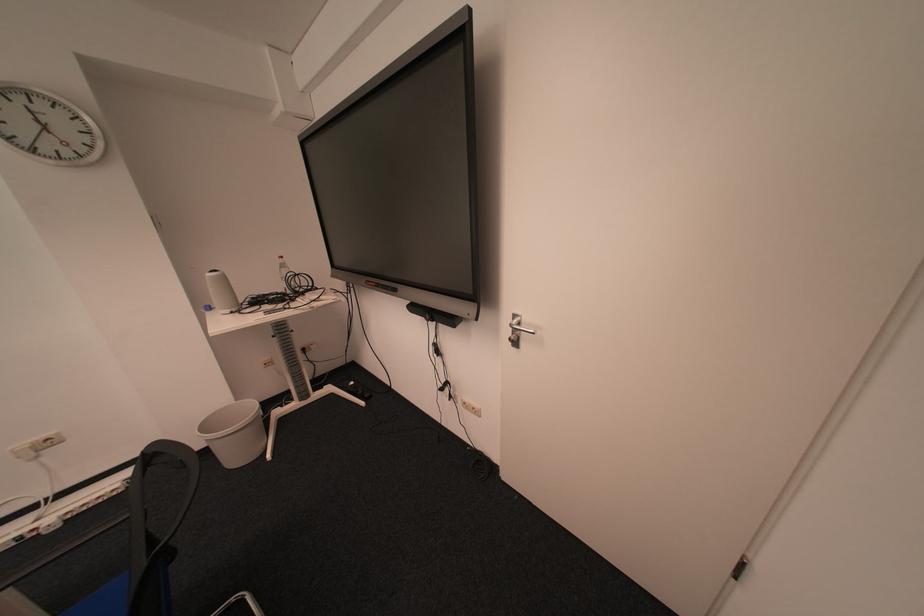
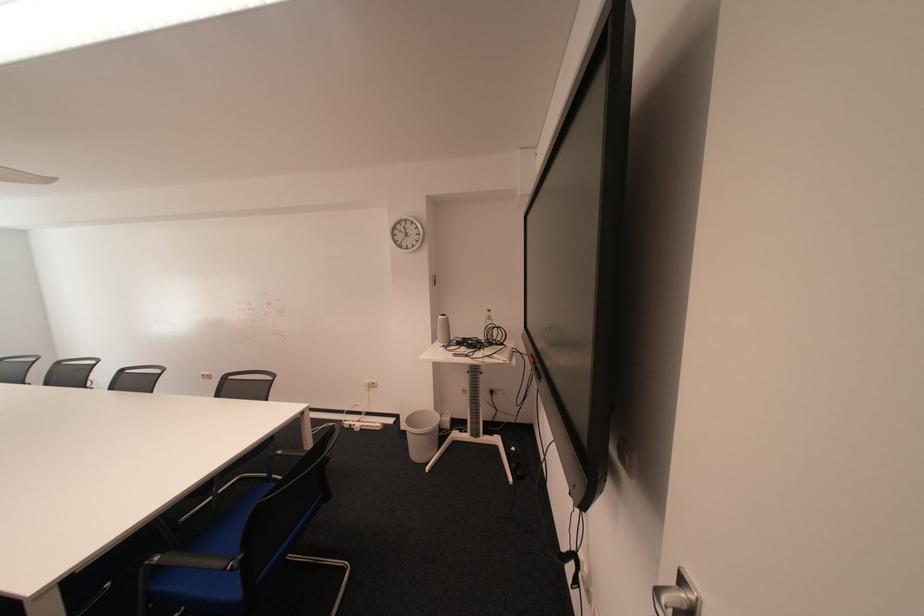
Question: How did the camera likely rotate?

Choices:
 (A) Left
 (B) Right
 (C) Up
 (D) Down

Answer: (A)